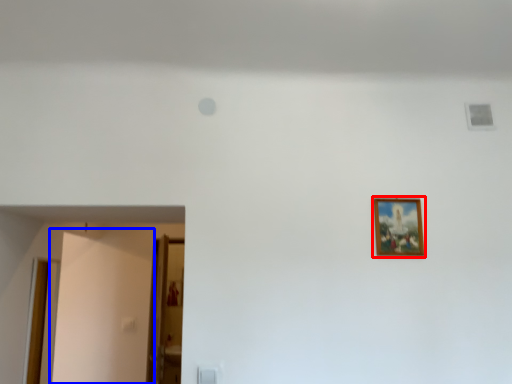
Question: Which object is closer to the camera taking this photo, picture frame (highlighted by a red box) or door (highlighted by a blue box)?

Choices:
 (A) picture frame
 (B) door

Answer: (A)